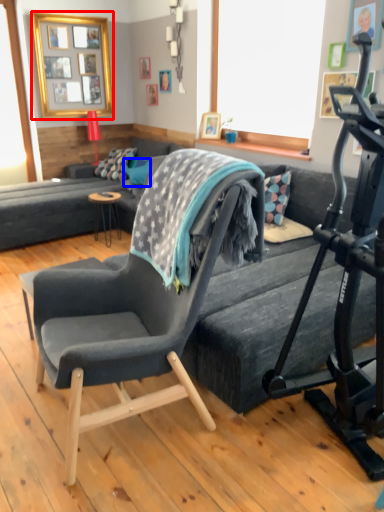
Question: Which object appears farthest to the camera in this image, picture frame (highlighted by a red box) or pillow (highlighted by a blue box)?

Choices:
 (A) picture frame
 (B) pillow

Answer: (B)